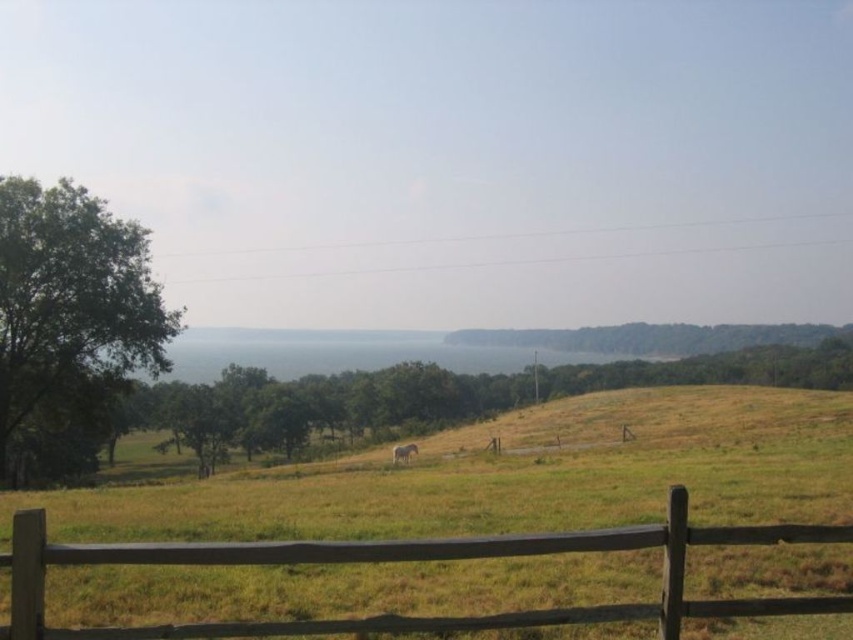
Question: Based on their relative distances, which object is nearer to the green leafy tree at center?

Choices:
 (A) green leafy tree at left
 (B) brown wooden fence at lower center
 (C) brown textured horse at center

Answer: (A)

Question: Is green leafy tree at center positioned before green leafy tree at left?

Choices:
 (A) no
 (B) yes

Answer: (A)

Question: Which of the following is the farthest from the observer?

Choices:
 (A) (315, 388)
 (B) (45, 280)

Answer: (A)

Question: Does brown wooden fence at lower center come in front of green leafy tree at left?

Choices:
 (A) no
 (B) yes

Answer: (B)

Question: Which point is farther to the camera?

Choices:
 (A) green leafy tree at left
 (B) brown wooden fence at lower center

Answer: (A)

Question: Is green leafy tree at left thinner than brown textured horse at center?

Choices:
 (A) yes
 (B) no

Answer: (B)